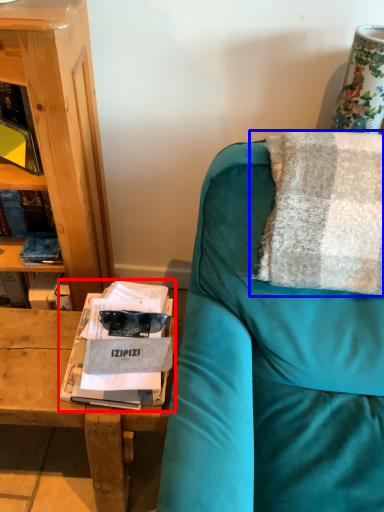
Question: Which object appears farthest to the camera in this image, magazine (highlighted by a red box) or pillow (highlighted by a blue box)?

Choices:
 (A) magazine
 (B) pillow

Answer: (A)